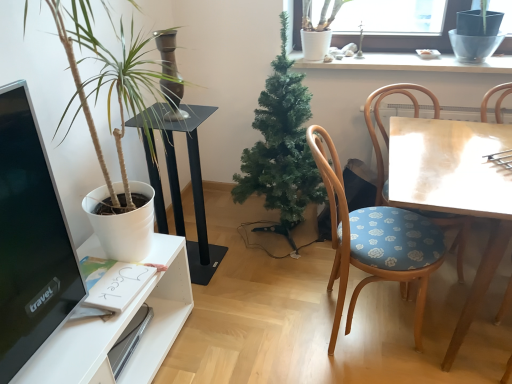
I want to click on vacant space behind black glass table at center, so click(222, 238).